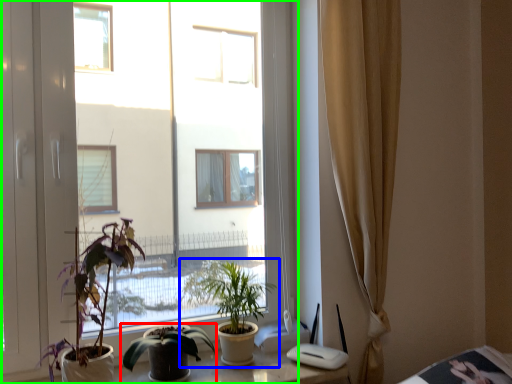
Question: Which is nearer to the houseplant (highlighted by a red box)? houseplant (highlighted by a blue box) or window (highlighted by a green box).

Choices:
 (A) houseplant
 (B) window

Answer: (A)